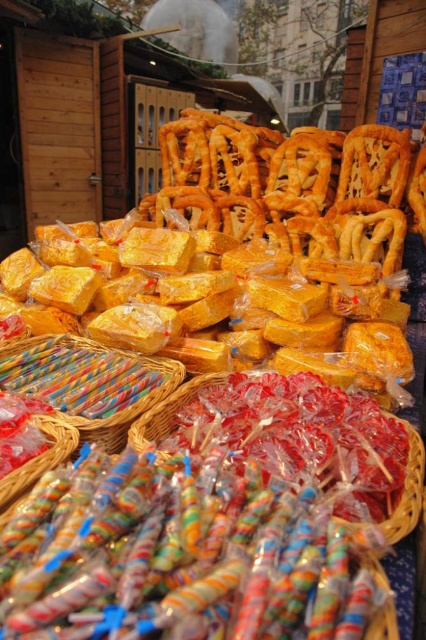
You are a customer at the market stall and want to place both the multicolored plastic candy sticks at center and the multicolored plastic candy at lower center into a gift box. The gift box has a maximum depth of 10 inches. Can you fit both items in the box without overlapping?

The multicolored plastic candy sticks at center is 11.09 inches away from multicolored plastic candy at lower center. Since the distance between them exceeds the gift box depth of 10 inches, they cannot be placed in the box without overlapping.

You are a delivery person who needs to place a package that is 30 inches long between the two points marked as point (333, 529). Will the package fit between them?

The distance between the two points marked as point (333, 529) is 31.08 inches, so the package will fit since it is only 30 inches long.